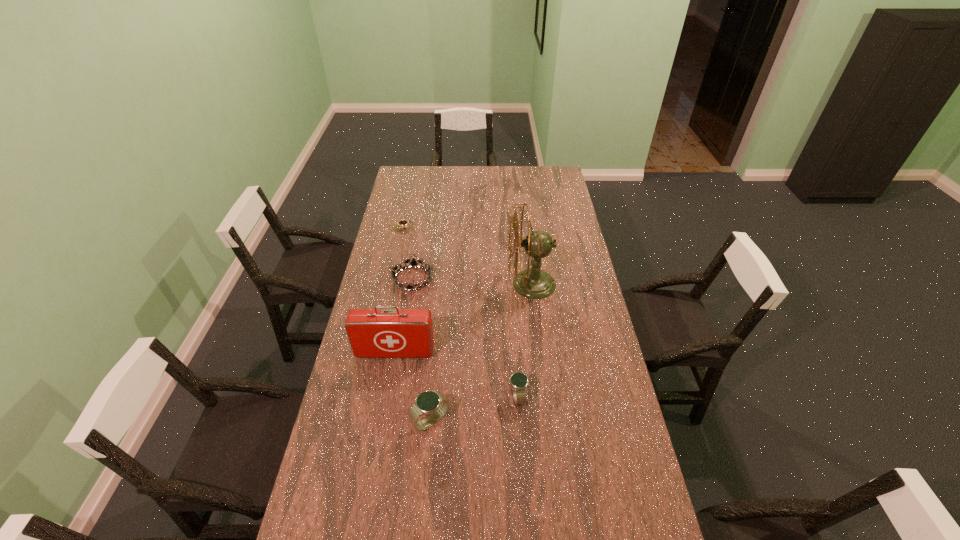
Please point a spot on the right to add another watch. Please provide its 2D coordinates. Your answer should be formatted as a tuple, i.e. [(x, y)], where the tuple contains the x and y coordinates of a point satisfying the conditions above.

[(597, 373)]